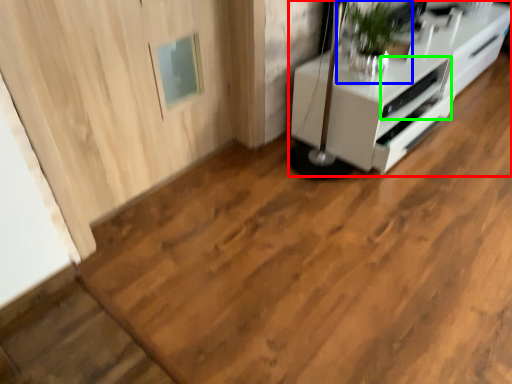
Question: Estimate the real-world distances between objects in this image. Which object is closer to furniture (highlighted by a red box), houseplant (highlighted by a blue box) or appliance (highlighted by a green box)?

Choices:
 (A) houseplant
 (B) appliance

Answer: (B)